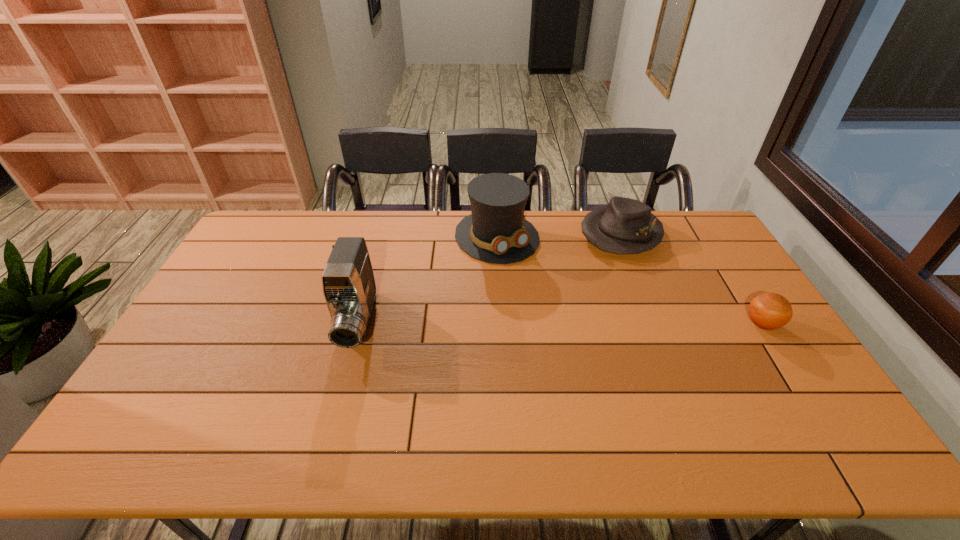
This screenshot has height=540, width=960. In order to click on vacant space located with goggles on the front of the third shortest object in this screenshot , I will do `click(535, 277)`.

I want to click on free region located 0.380m with goggles on the front of the third shortest object, so click(x=591, y=336).

Locate an element on the screen. The image size is (960, 540). free location located 0.220m with goggles on the front of the third shortest object is located at coordinates (558, 302).

Locate an element on the screen. Image resolution: width=960 pixels, height=540 pixels. hat situated at the far edge is located at coordinates (625, 226).

The height and width of the screenshot is (540, 960). What are the coordinates of `dress hat that is at the far edge` in the screenshot? It's located at (496, 231).

Locate an element on the screen. object situated at the right edge is located at coordinates (769, 311).

Locate an element on the screen. The height and width of the screenshot is (540, 960). vacant space at the far edge is located at coordinates (328, 222).

Find the location of a particular element. blank space at the near edge of the desktop is located at coordinates (282, 384).

Locate an element on the screen. vacant position at the left edge of the desktop is located at coordinates (219, 293).

Find the location of `free space at the right edge of the desktop`. free space at the right edge of the desktop is located at coordinates pos(706,286).